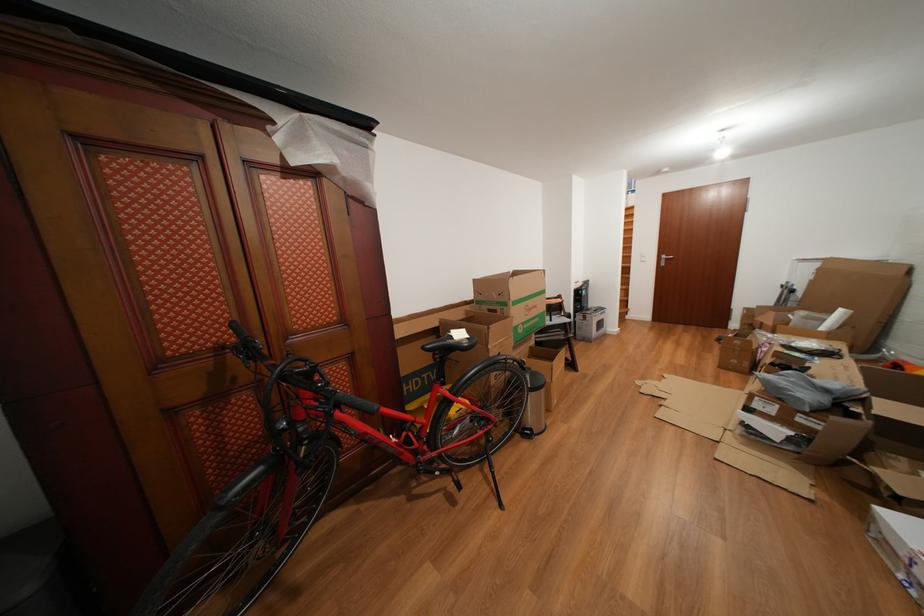
What do you see at coordinates (455, 480) in the screenshot? I see `the bicycle pedal` at bounding box center [455, 480].